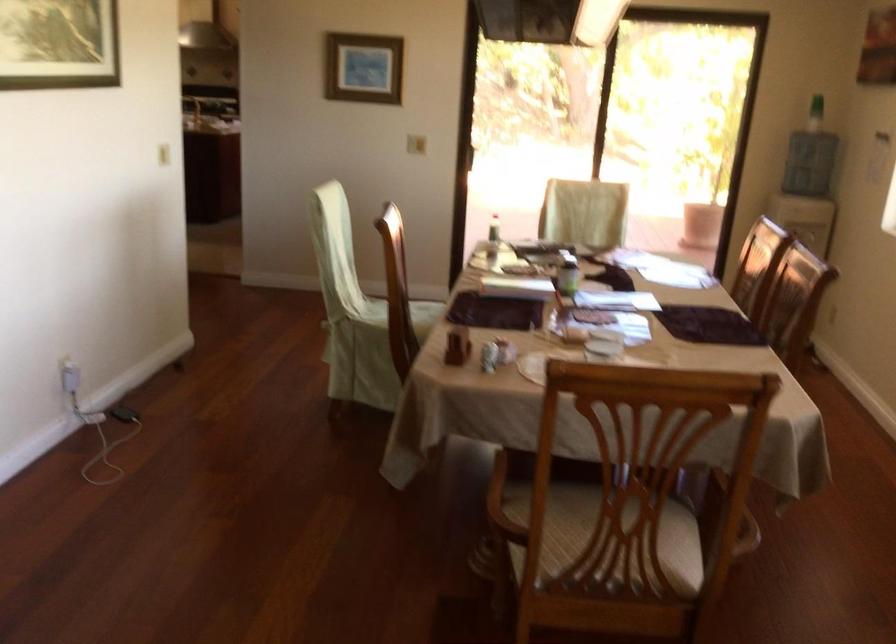
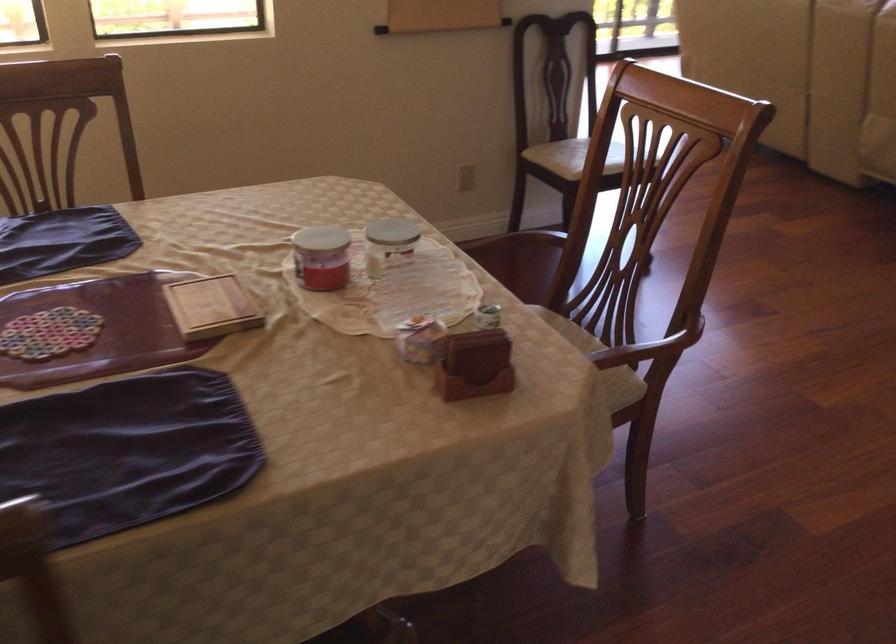
Find the pixel in the second image that matches point (488, 486) in the first image.

(642, 351)